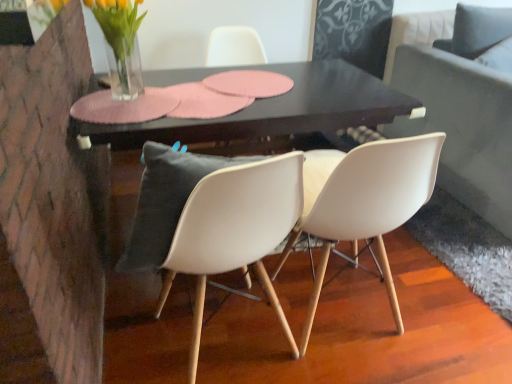
Question: In terms of height, does white matte chair at center, which is counted as the 2th chair, starting from the front, look taller or shorter compared to white plastic chair at center, acting as the third chair starting from the front?

Choices:
 (A) short
 (B) tall

Answer: (B)

Question: Is point (406, 216) closer or farther from the camera than point (237, 51)?

Choices:
 (A) farther
 (B) closer

Answer: (B)

Question: Considering the real-world distances, which object is farthest from the white matte chair at center, which is counted as the 2th chair, starting from the front?

Choices:
 (A) clear glass vase at upper left
 (B) white plastic chair at center, acting as the third chair starting from the front
 (C) white plastic chair at center, the 3th chair viewed from the back
 (D) dark gray fabric couch at right
 (E) black glossy table at center

Answer: (B)

Question: Estimate the real-world distances between objects in this image. Which object is closer to the white matte chair at center, the 2th chair when ordered from back to front?

Choices:
 (A) dark gray fabric couch at right
 (B) white plastic chair at center, the first chair in the front-to-back sequence
 (C) white plastic chair at center, the first chair from the back
 (D) clear glass vase at upper left
 (E) black glossy table at center

Answer: (B)